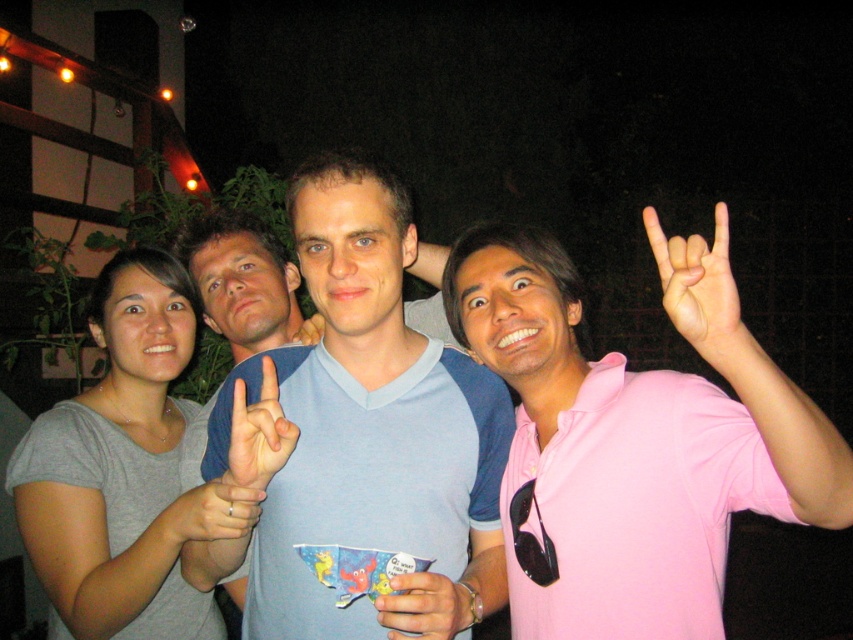
Question: Is gray cotton shirt at left positioned in front of matte blue shirt at center?

Choices:
 (A) yes
 (B) no

Answer: (B)

Question: Can you confirm if pink cotton shirt at right is positioned to the left of matte pink hand at upper right?

Choices:
 (A) no
 (B) yes

Answer: (B)

Question: Is light blue cotton shirt at center smaller than pink cotton shirt at right?

Choices:
 (A) yes
 (B) no

Answer: (A)

Question: Which of the following is the farthest from the observer?

Choices:
 (A) matte pink hand at upper right
 (B) light blue cotton shirt at center
 (C) matte blue shirt at center

Answer: (C)

Question: Which object appears closest to the camera in this image?

Choices:
 (A) pink cotton shirt at right
 (B) matte blue shirt at center
 (C) matte pink hand at upper right

Answer: (A)

Question: Which of these objects is positioned farthest from the pink cotton shirt at right?

Choices:
 (A) white matte hand at center
 (B) matte pink hand at upper right
 (C) light blue cotton shirt at center
 (D) matte blue shirt at center

Answer: (D)